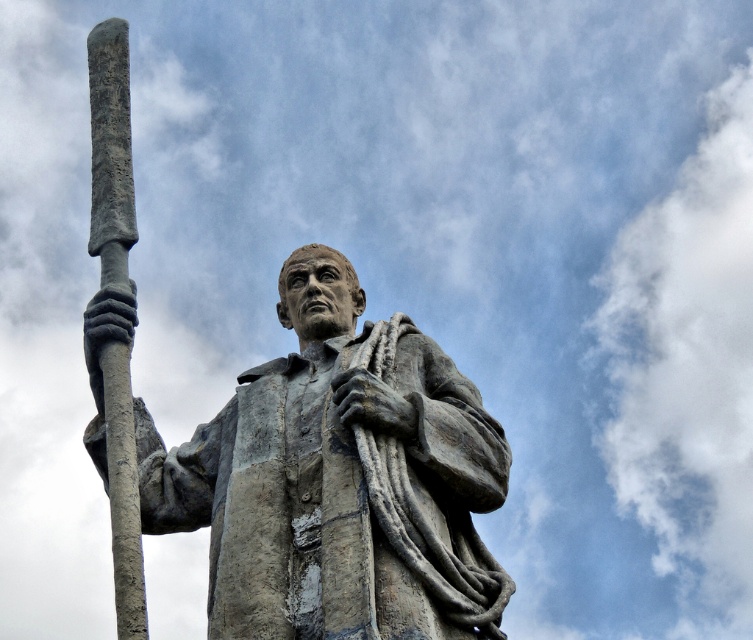
In the scene shown: Who is taller, bronze statue at center or gray stone spear at left?

With more height is gray stone spear at left.

Is bronze statue at center taller than gray stone spear at left?

No, bronze statue at center is not taller than gray stone spear at left.

Does point (456, 472) lie behind point (108, 378)?

No, it is in front of (108, 378).

The width and height of the screenshot is (753, 640). Identify the location of bronze statue at center. (337, 480).